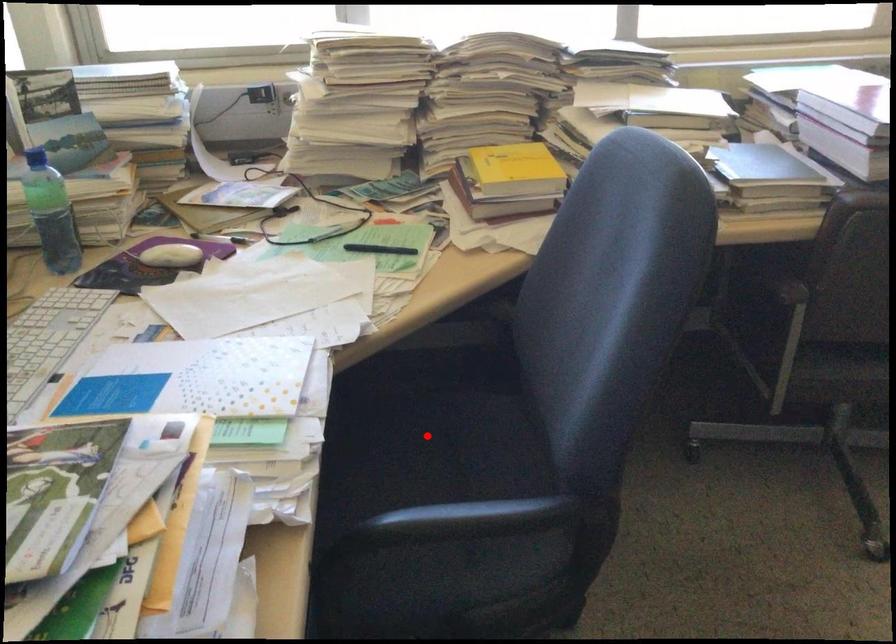
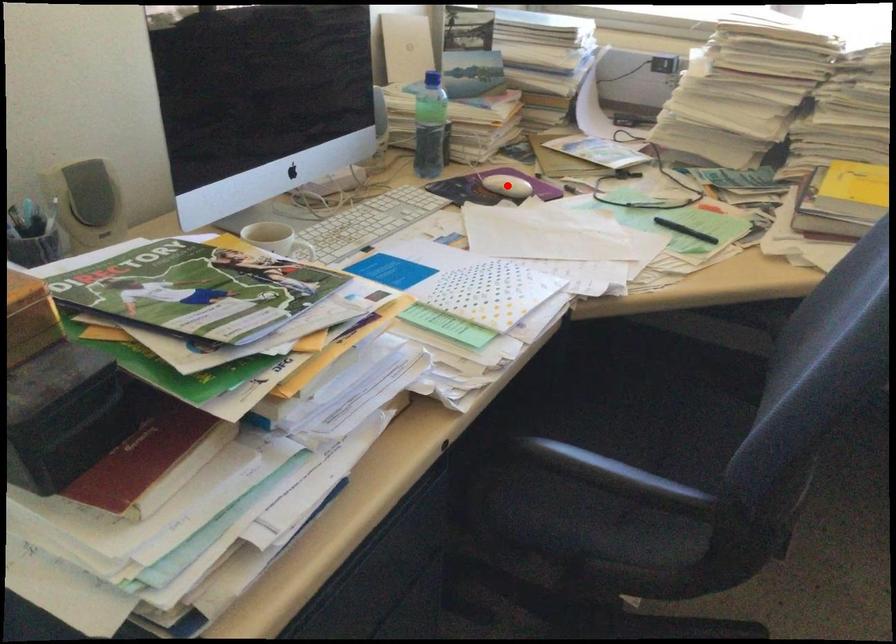
From the picture: I am providing you with two images of the same scene from different viewpoints. A red point is marked on the first image and another point is marked on the second image. Are the points marked in image1 and image2 representing the same 3D position?

No